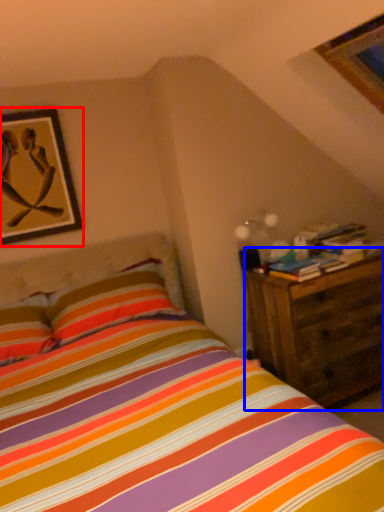
Question: Which object appears farthest to the camera in this image, picture frame (highlighted by a red box) or nightstand (highlighted by a blue box)?

Choices:
 (A) picture frame
 (B) nightstand

Answer: (A)